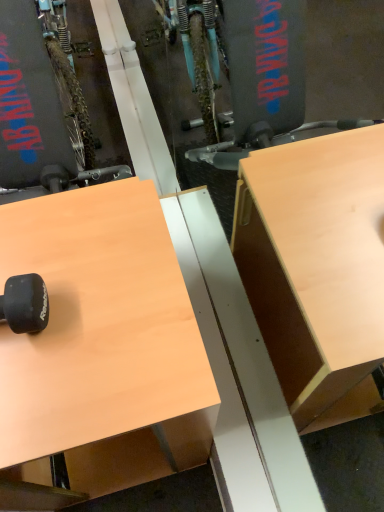
The height and width of the screenshot is (512, 384). In order to click on vacant space to the right of black rubber dumbbell at lower left in this screenshot , I will do `click(82, 324)`.